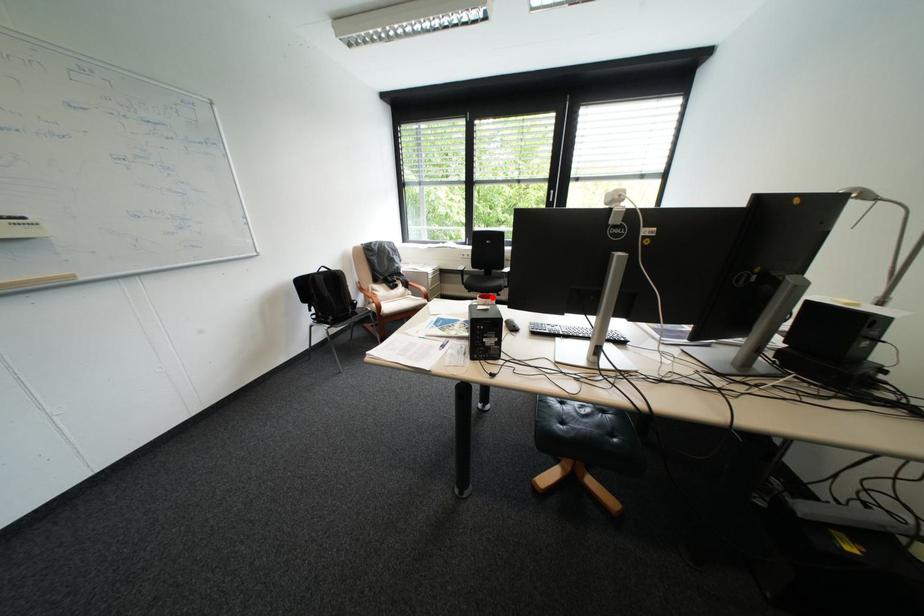
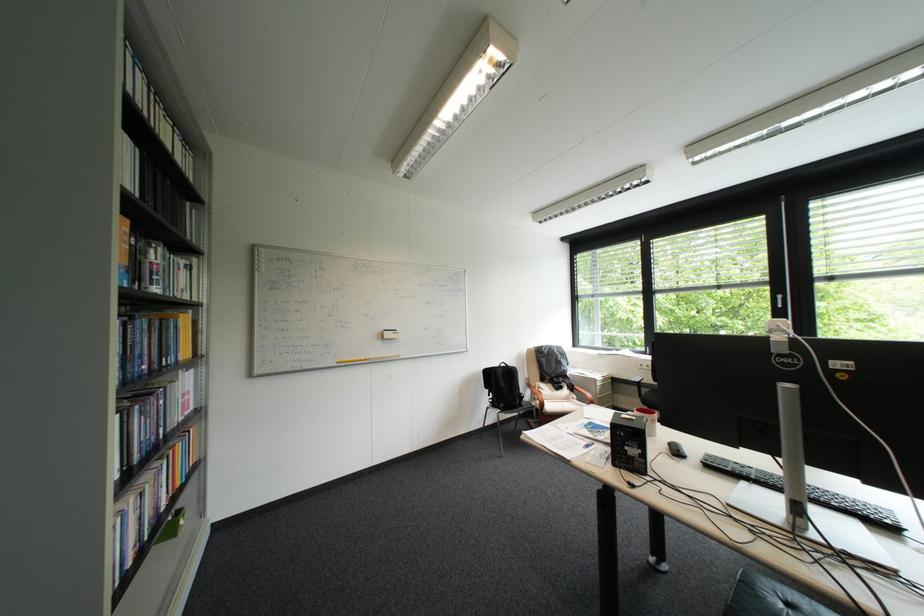
Question: I am providing you with two images of the same scene from different viewpoints. A red point is marked on the first image. At the location where the point appears in image 1, is it still visible in image 2?

Choices:
 (A) Yes
 (B) No

Answer: (A)